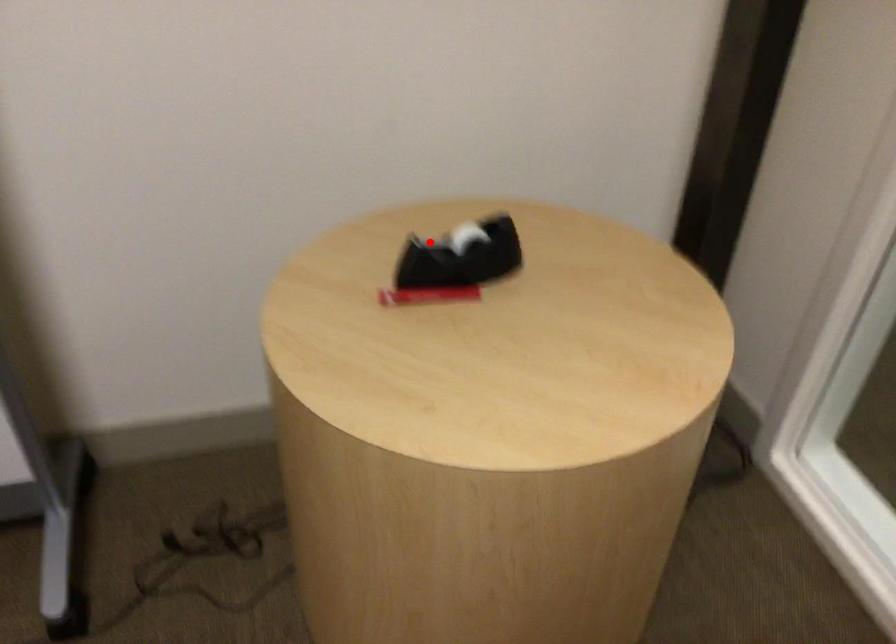
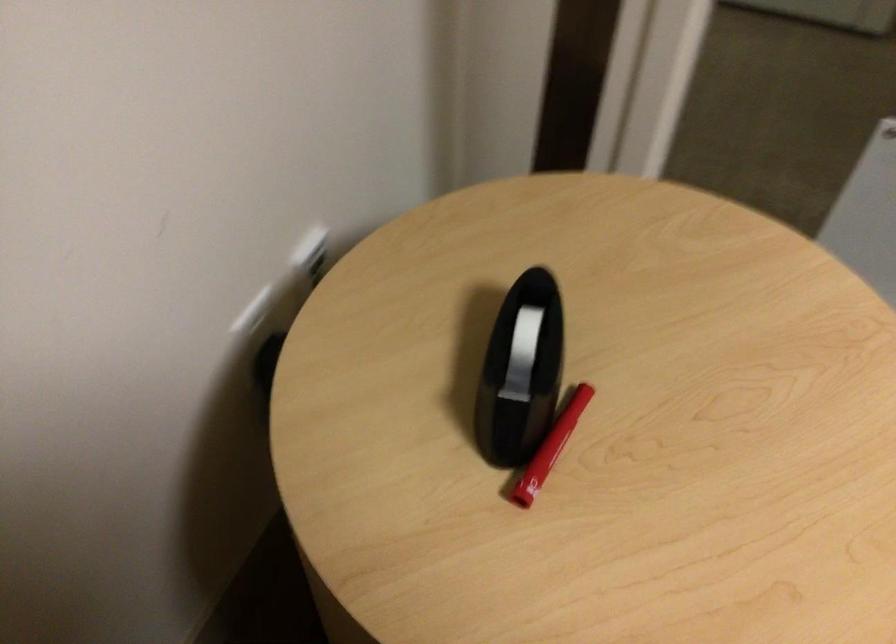
Find the pixel in the second image that matches the highlighted location in the first image.

(521, 371)